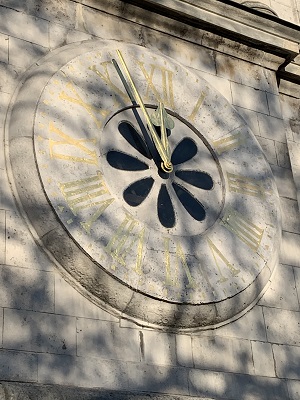
Find the location of a particular element. Image resolution: width=300 pixels, height=400 pixels. edge of wall is located at coordinates (282, 24).